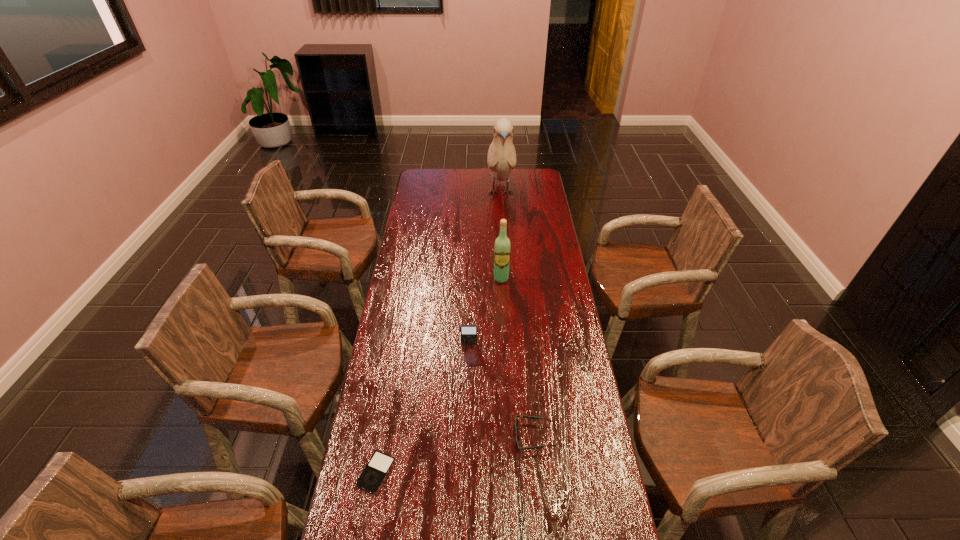
The width and height of the screenshot is (960, 540). Identify the location of vacant area between the fourth object from right to left and the nearer iPod. (422, 408).

Find the location of a particular element. free spot between the second farthest object and the shorter iPod is located at coordinates (439, 376).

This screenshot has height=540, width=960. Identify the location of vacant space that is in between the third farthest object and the shortest object. (422, 408).

The height and width of the screenshot is (540, 960). Identify the location of object that is the fourth closest to the taller iPod. (501, 159).

Select which object appears as the second closest to the left iPod. Please provide its 2D coordinates. Your answer should be formatted as a tuple, i.e. [(x, y)], where the tuple contains the x and y coordinates of a point satisfying the conditions above.

[(469, 335)]